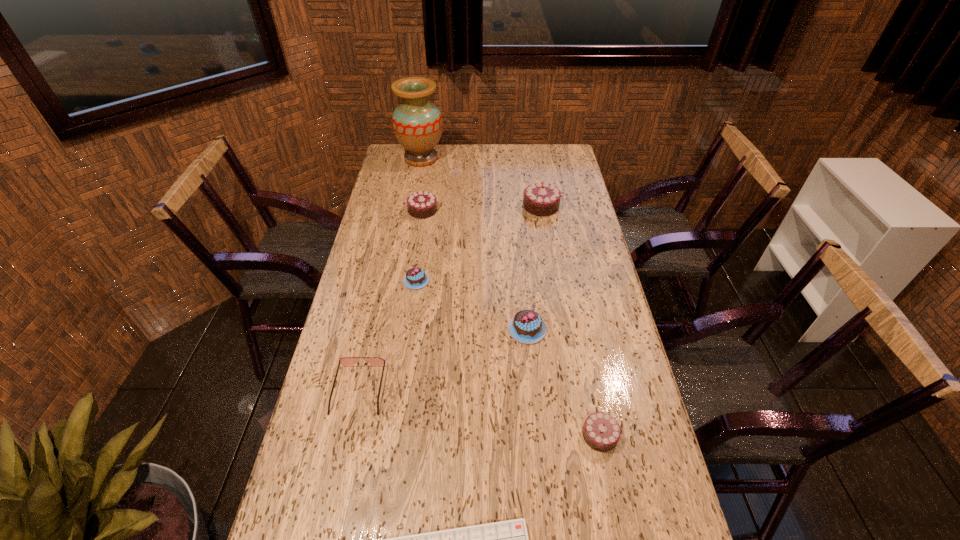
Locate an element on the screen. The width and height of the screenshot is (960, 540). empty space between the seventh shortest object and the vase is located at coordinates (481, 182).

Find the location of a particular element. empty space between the second smallest chocolate chocolate cake and the tallest chocolate cake is located at coordinates [482, 208].

The width and height of the screenshot is (960, 540). I want to click on vacant area that lies between the farthest object and the leftmost chocolate chocolate cake, so click(x=421, y=184).

I want to click on vacant area that lies between the nearer pink chocolate cake and the left pink chocolate cake, so pyautogui.click(x=471, y=305).

At what (x,y) coordinates should I click in order to perform the action: click on the fourth closest object to the shortest object. Please return your answer as a coordinate pair (x, y). Looking at the image, I should click on (415, 278).

This screenshot has width=960, height=540. Find the location of `object that is the seventh closest to the left pink chocolate cake`. object that is the seventh closest to the left pink chocolate cake is located at coordinates (508, 539).

At what (x,y) coordinates should I click in order to perform the action: click on chocolate cake that can be found as the second closest to the farthest object. Please return your answer as a coordinate pair (x, y). This screenshot has height=540, width=960. Looking at the image, I should click on (541, 199).

Where is `chocolate cake that can be found as the third closest to the computer keyboard`? chocolate cake that can be found as the third closest to the computer keyboard is located at coordinates (x=415, y=278).

Locate which chocolate chocolate cake ranks second in proximity to the sunglasses. Please provide its 2D coordinates. Your answer should be formatted as a tuple, i.e. [(x, y)], where the tuple contains the x and y coordinates of a point satisfying the conditions above.

[(422, 204)]

Locate which chocolate chocolate cake ranks in proximity to the third nearest object. Please provide its 2D coordinates. Your answer should be formatted as a tuple, i.e. [(x, y)], where the tuple contains the x and y coordinates of a point satisfying the conditions above.

[(601, 431)]